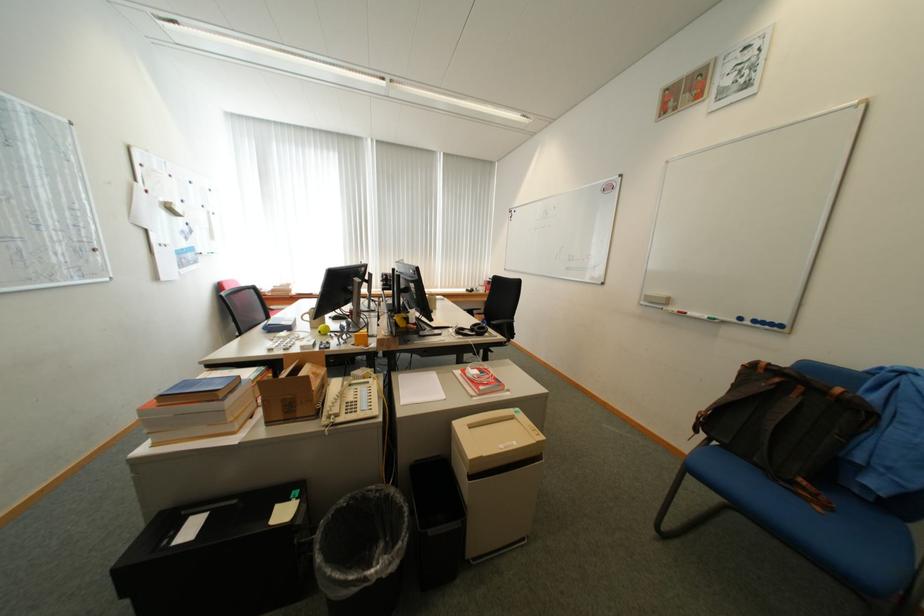
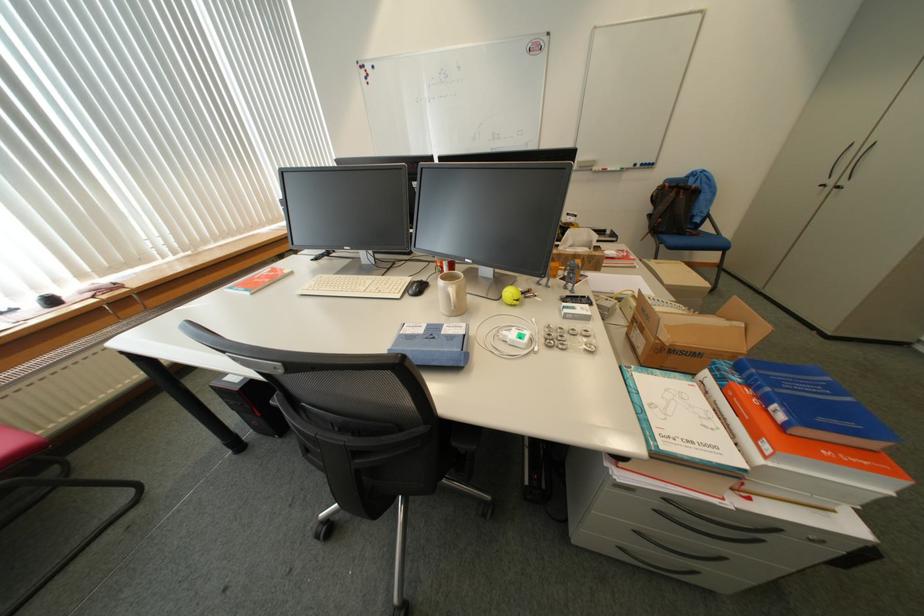
Locate, in the second image, the point that corresponds to point (792, 390) in the first image.

(687, 195)